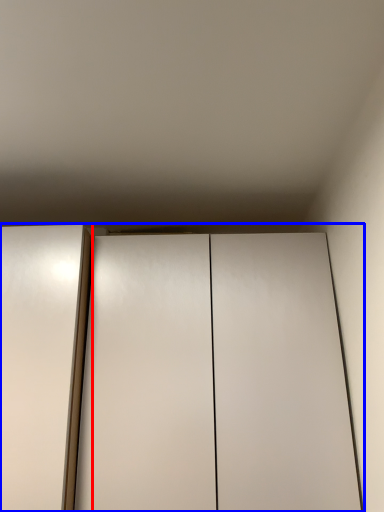
Question: Which of the following is the farthest to the observer, elevator (highlighted by a red box) or cupboard (highlighted by a blue box)?

Choices:
 (A) elevator
 (B) cupboard

Answer: (B)